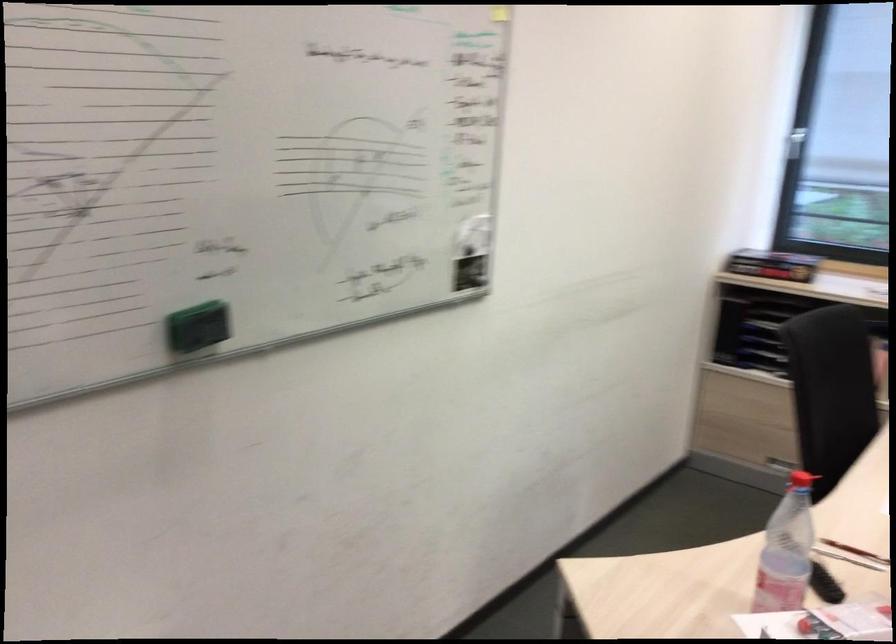
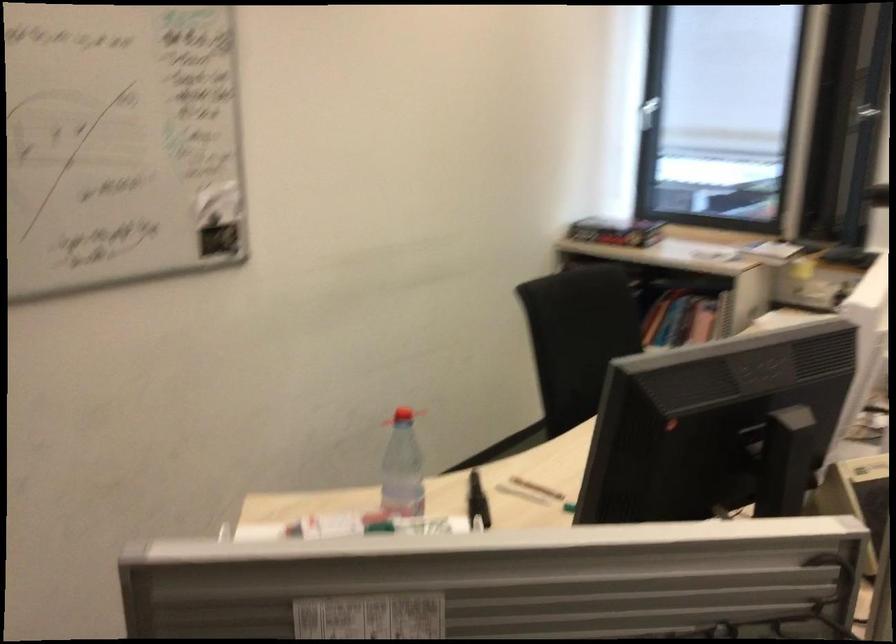
Find the pixel in the second image that matches point (786, 270) in the first image.

(615, 232)